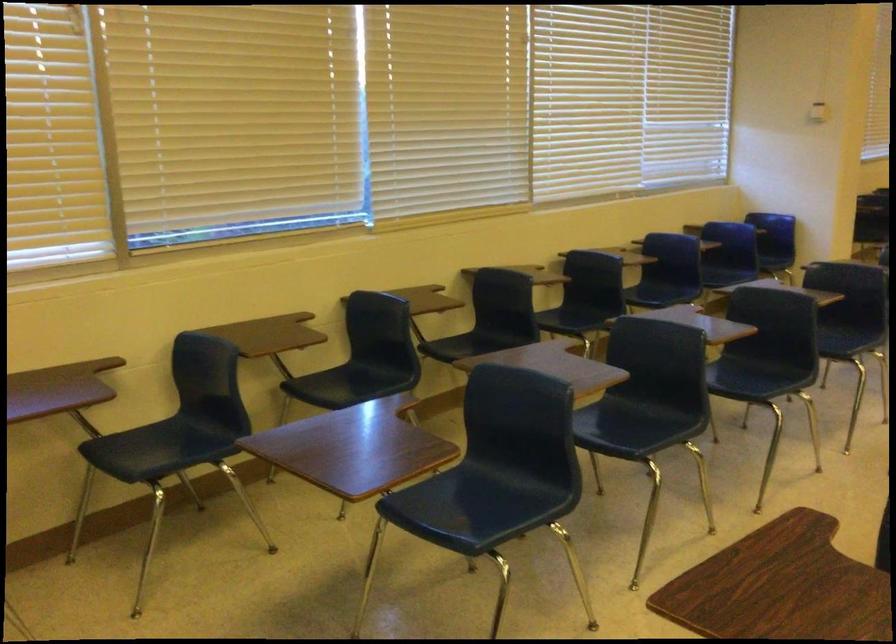
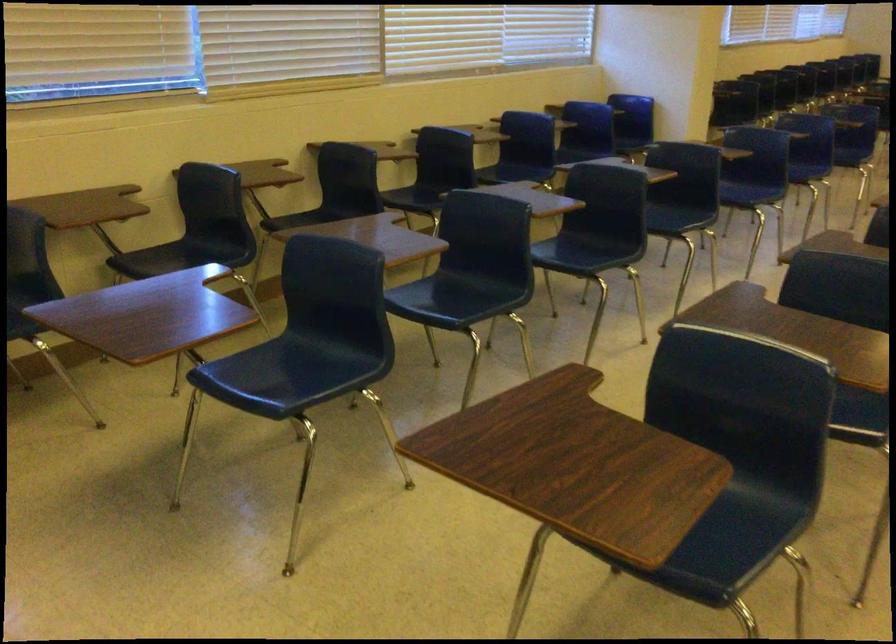
Question: The images are taken continuously from a first-person perspective. In which direction is your viewpoint rotating?

Choices:
 (A) Left
 (B) Right
 (C) Up
 (D) Down

Answer: (D)